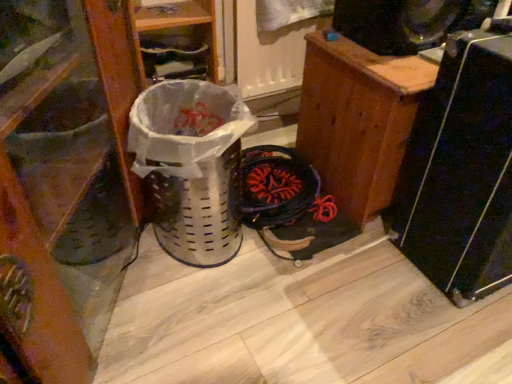
At what (x,y) coordinates should I click in order to perform the action: click on white plastic basket at center. Please return your answer as a coordinate pair (x, y). Looking at the image, I should click on (191, 167).

This screenshot has width=512, height=384. What do you see at coordinates (358, 120) in the screenshot?
I see `wooden cabinet at right, the first furniture when ordered from right to left` at bounding box center [358, 120].

This screenshot has width=512, height=384. What do you see at coordinates (63, 184) in the screenshot?
I see `wooden shoe at left, acting as the second furniture starting from the right` at bounding box center [63, 184].

You are a GUI agent. You are given a task and a screenshot of the screen. Output one action in this format:
    pyautogui.click(x=<x>, y=<y>)
    Task: Click on the black plastic speaker at upper right
    The image size is (512, 384).
    Given the screenshot: What is the action you would take?
    pyautogui.click(x=406, y=22)

What are the coordinates of `transparent plastic screen door at upper center` in the screenshot? It's located at (272, 44).

I want to click on white plastic basket at center, so click(x=191, y=167).

Considering the sizes of wooden cabinet at right, the first furniture when ordered from right to left, and transparent plastic screen door at upper center in the image, is wooden cabinet at right, the first furniture when ordered from right to left, taller or shorter than transparent plastic screen door at upper center?

In the image, wooden cabinet at right, the first furniture when ordered from right to left, appears to be taller than transparent plastic screen door at upper center.

From a real-world perspective, does wooden cabinet at right, which ranks as the second furniture in left-to-right order, sit lower than transparent plastic screen door at upper center?

Yes, from a real-world perspective, wooden cabinet at right, which ranks as the second furniture in left-to-right order, is beneath transparent plastic screen door at upper center.

The width and height of the screenshot is (512, 384). I want to click on screen door above the wooden cabinet at right, the first furniture when ordered from right to left (from a real-world perspective), so click(x=272, y=44).

Considering the relative positions of wooden shoe at left, arranged as the 1th furniture when viewed from the left, and wooden cabinet at right, the first furniture when ordered from right to left, in the image provided, is wooden shoe at left, arranged as the 1th furniture when viewed from the left, to the left of wooden cabinet at right, the first furniture when ordered from right to left, from the viewer's perspective?

Yes, wooden shoe at left, arranged as the 1th furniture when viewed from the left, is to the left of wooden cabinet at right, the first furniture when ordered from right to left.

Considering the relative sizes of wooden shoe at left, acting as the second furniture starting from the right, and wooden cabinet at right, the first furniture when ordered from right to left, in the image provided, is wooden shoe at left, acting as the second furniture starting from the right, smaller than wooden cabinet at right, the first furniture when ordered from right to left,?

Actually, wooden shoe at left, acting as the second furniture starting from the right, might be larger than wooden cabinet at right, the first furniture when ordered from right to left.

Does point (9, 10) come closer to viewer compared to point (380, 129)?

Yes, it is in front of point (380, 129).

In terms of height, does wooden shoe at left, arranged as the 1th furniture when viewed from the left, look taller or shorter compared to wooden cabinet at right, the first furniture when ordered from right to left?

Clearly, wooden shoe at left, arranged as the 1th furniture when viewed from the left, is taller compared to wooden cabinet at right, the first furniture when ordered from right to left.

Locate an element on the screen. The width and height of the screenshot is (512, 384). screen door lying on the left of black plastic speaker at upper right is located at coordinates (272, 44).

Is transparent plastic screen door at upper center in front of or behind black plastic speaker at upper right in the image?

Clearly, transparent plastic screen door at upper center is behind black plastic speaker at upper right.

Can you confirm if transparent plastic screen door at upper center is smaller than black plastic speaker at upper right?

Indeed, transparent plastic screen door at upper center has a smaller size compared to black plastic speaker at upper right.

Does transparent plastic screen door at upper center have a lesser height compared to black plastic speaker at upper right?

No, transparent plastic screen door at upper center is not shorter than black plastic speaker at upper right.

Which of these two, white plastic basket at center or wooden cabinet at right, which ranks as the second furniture in left-to-right order, is bigger?

wooden cabinet at right, which ranks as the second furniture in left-to-right order, is bigger.

Is white plastic basket at center located outside wooden cabinet at right, the first furniture when ordered from right to left?

Yes, white plastic basket at center is not within wooden cabinet at right, the first furniture when ordered from right to left.

Between point (194, 225) and point (425, 73), which one is positioned in front?

Point (425, 73)

Does white plastic basket at center touch wooden cabinet at right, the first furniture when ordered from right to left?

No, white plastic basket at center is not touching wooden cabinet at right, the first furniture when ordered from right to left.

From a real-world perspective, between transparent plastic screen door at upper center and wooden shoe at left, arranged as the 1th furniture when viewed from the left, who is vertically lower?

transparent plastic screen door at upper center, from a real-world perspective.

Can you see transparent plastic screen door at upper center touching wooden shoe at left, arranged as the 1th furniture when viewed from the left?

No, transparent plastic screen door at upper center is not making contact with wooden shoe at left, arranged as the 1th furniture when viewed from the left.

You are a GUI agent. You are given a task and a screenshot of the screen. Output one action in this format:
    pyautogui.click(x=<x>, y=<y>)
    Task: Click on the screen door behind the wooden shoe at left, acting as the second furniture starting from the right
    The image size is (512, 384).
    Given the screenshot: What is the action you would take?
    pyautogui.click(x=272, y=44)

Between transparent plastic screen door at upper center and wooden shoe at left, acting as the second furniture starting from the right, which one has less height?

transparent plastic screen door at upper center.

Is there a large distance between wooden shoe at left, acting as the second furniture starting from the right, and black plastic speaker at right?

They are positioned close to each other.

Does wooden shoe at left, arranged as the 1th furniture when viewed from the left, lie behind black plastic speaker at right?

No.

Considering the relative sizes of wooden shoe at left, arranged as the 1th furniture when viewed from the left, and black plastic speaker at right in the image provided, is wooden shoe at left, arranged as the 1th furniture when viewed from the left, shorter than black plastic speaker at right?

No.

Which is in front, point (72, 267) or point (494, 96)?

The point (494, 96) is in front.

Is wooden cabinet at right, the first furniture when ordered from right to left, looking in the opposite direction of wooden shoe at left, arranged as the 1th furniture when viewed from the left?

No, wooden cabinet at right, the first furniture when ordered from right to left, is not facing the opposite direction of wooden shoe at left, arranged as the 1th furniture when viewed from the left.

Is wooden cabinet at right, which ranks as the second furniture in left-to-right order, positioned before wooden shoe at left, acting as the second furniture starting from the right?

No, wooden cabinet at right, which ranks as the second furniture in left-to-right order, is further to the viewer.

How much distance is there between wooden cabinet at right, the first furniture when ordered from right to left, and wooden shoe at left, acting as the second furniture starting from the right?

The distance of wooden cabinet at right, the first furniture when ordered from right to left, from wooden shoe at left, acting as the second furniture starting from the right, is 22.51 inches.

Is wooden cabinet at right, which ranks as the second furniture in left-to-right order, to the left of wooden shoe at left, acting as the second furniture starting from the right, from the viewer's perspective?

Incorrect, wooden cabinet at right, which ranks as the second furniture in left-to-right order, is not on the left side of wooden shoe at left, acting as the second furniture starting from the right.

The image size is (512, 384). In order to click on furniture beneath the transparent plastic screen door at upper center (from a real-world perspective) in this screenshot , I will do `click(358, 120)`.

Where is `furniture on the left of wooden cabinet at right, which ranks as the second furniture in left-to-right order`? furniture on the left of wooden cabinet at right, which ranks as the second furniture in left-to-right order is located at coordinates (63, 184).

Estimate the real-world distances between objects in this image. Which object is further from wooden cabinet at right, the first furniture when ordered from right to left, black plastic speaker at upper right or wooden shoe at left, acting as the second furniture starting from the right?

wooden shoe at left, acting as the second furniture starting from the right, is further to wooden cabinet at right, the first furniture when ordered from right to left.

Estimate the real-world distances between objects in this image. Which object is closer to white plastic basket at center, black plastic speaker at right or wooden shoe at left, arranged as the 1th furniture when viewed from the left?

Among the two, wooden shoe at left, arranged as the 1th furniture when viewed from the left, is located nearer to white plastic basket at center.

Considering their positions, is transparent plastic screen door at upper center positioned closer to wooden shoe at left, arranged as the 1th furniture when viewed from the left, than black plastic speaker at upper right?

Among the two, transparent plastic screen door at upper center is located nearer to wooden shoe at left, arranged as the 1th furniture when viewed from the left.

Looking at the image, which one is located closer to transparent plastic screen door at upper center, black plastic speaker at right or wooden cabinet at right, which ranks as the second furniture in left-to-right order?

Among the two, wooden cabinet at right, which ranks as the second furniture in left-to-right order, is located nearer to transparent plastic screen door at upper center.

From the image, which object appears to be farther from black plastic speaker at upper right, wooden shoe at left, arranged as the 1th furniture when viewed from the left, or wooden cabinet at right, which ranks as the second furniture in left-to-right order?

wooden shoe at left, arranged as the 1th furniture when viewed from the left, is further to black plastic speaker at upper right.

Looking at this image, which object lies further to the anchor point transparent plastic screen door at upper center, black plastic speaker at right or black plastic speaker at upper right?

black plastic speaker at right.

Looking at the image, which one is located closer to wooden cabinet at right, which ranks as the second furniture in left-to-right order, white plastic basket at center or black plastic speaker at upper right?

black plastic speaker at upper right is positioned closer to the anchor wooden cabinet at right, which ranks as the second furniture in left-to-right order.

Based on the photo, from the image, which object appears to be nearer to wooden cabinet at right, the first furniture when ordered from right to left, white plastic basket at center or transparent plastic screen door at upper center?

The object closer to wooden cabinet at right, the first furniture when ordered from right to left, is transparent plastic screen door at upper center.

The image size is (512, 384). Find the location of `speaker between wooden shoe at left, arranged as the 1th furniture when viewed from the left, and black plastic speaker at right`. speaker between wooden shoe at left, arranged as the 1th furniture when viewed from the left, and black plastic speaker at right is located at coordinates (406, 22).

Image resolution: width=512 pixels, height=384 pixels. What are the coordinates of `furniture between black plastic speaker at upper right and black plastic speaker at right from top to bottom` in the screenshot? It's located at (358, 120).

Find the location of a particular element. This screenshot has height=384, width=512. screen door located between white plastic basket at center and wooden cabinet at right, which ranks as the second furniture in left-to-right order, in the left-right direction is located at coordinates tap(272, 44).

At what (x,y) coordinates should I click in order to perform the action: click on screen door between wooden shoe at left, acting as the second furniture starting from the right, and wooden cabinet at right, the first furniture when ordered from right to left, in the horizontal direction. Please return your answer as a coordinate pair (x, y). The width and height of the screenshot is (512, 384). Looking at the image, I should click on (272, 44).